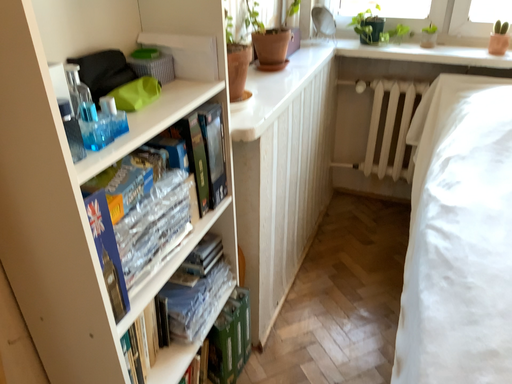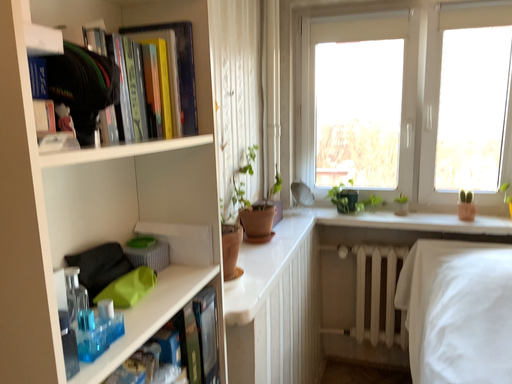
Question: How did the camera likely rotate when shooting the video?

Choices:
 (A) rotated downward
 (B) rotated upward

Answer: (B)